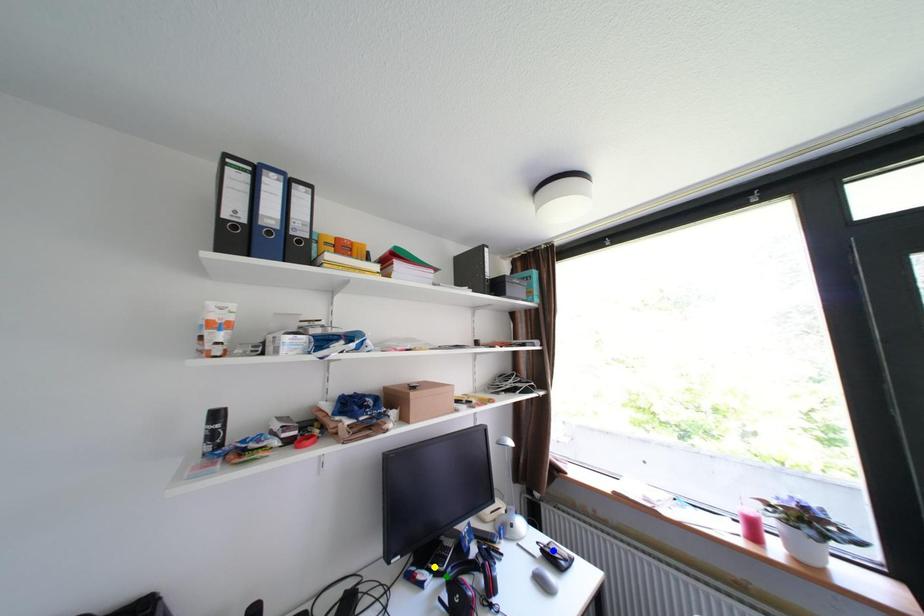
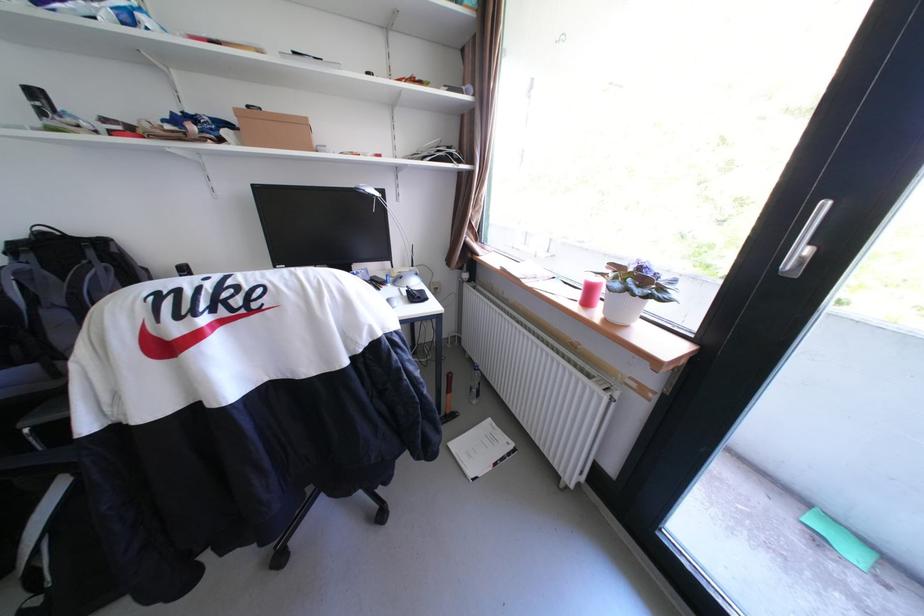
I am providing you with two images of the same scene from different viewpoints. Three points are marked in image1. Which point corresponds to a part or object that is occluded in image2?In image1, three points are marked. Which of them correspond to a part or object that is occluded in image2?Among the three points shown in image1, which one corresponds to a part or object that is no longer visible due to occlusion in image2?

green point, yellow point